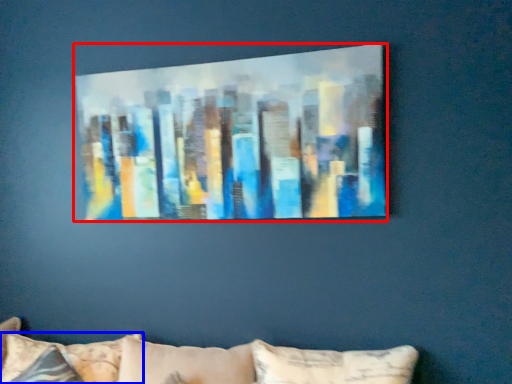
Question: Which object is further to the camera taking this photo, picture frame (highlighted by a red box) or pillow (highlighted by a blue box)?

Choices:
 (A) picture frame
 (B) pillow

Answer: (B)